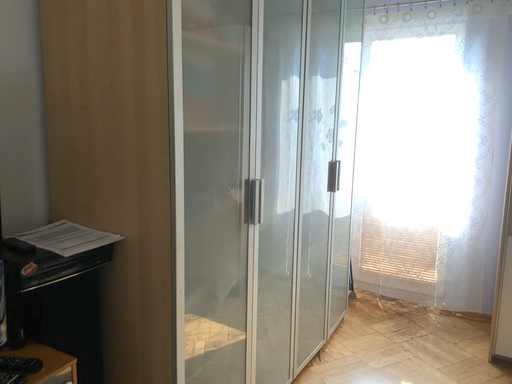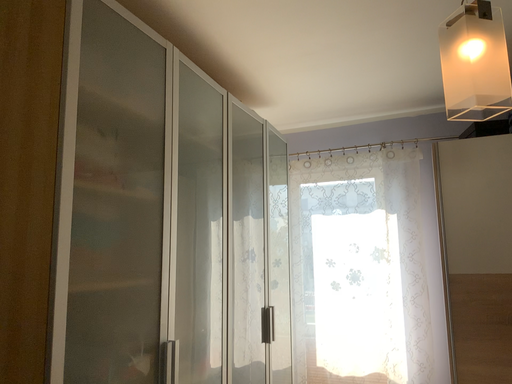
Question: Which way did the camera rotate in the video?

Choices:
 (A) rotated left
 (B) rotated right

Answer: (B)